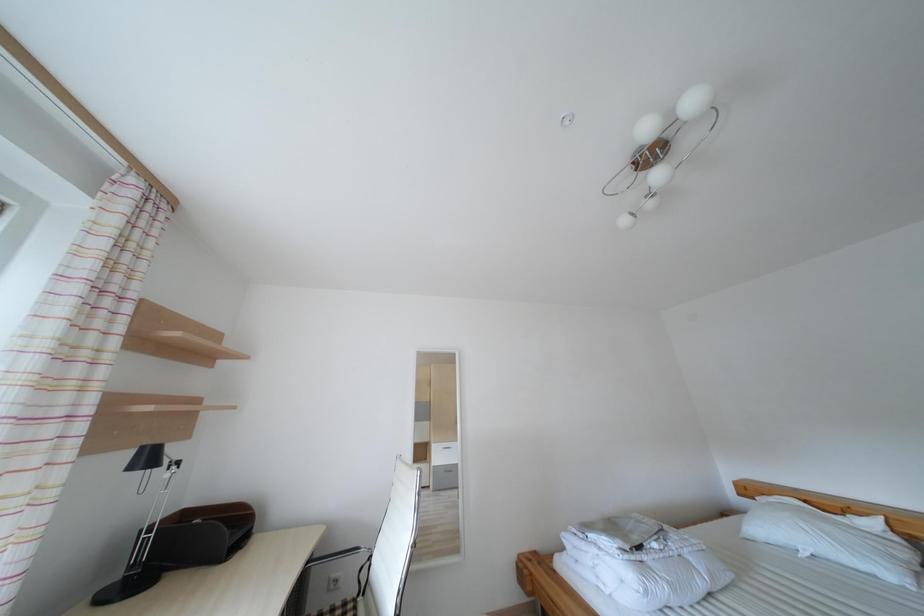
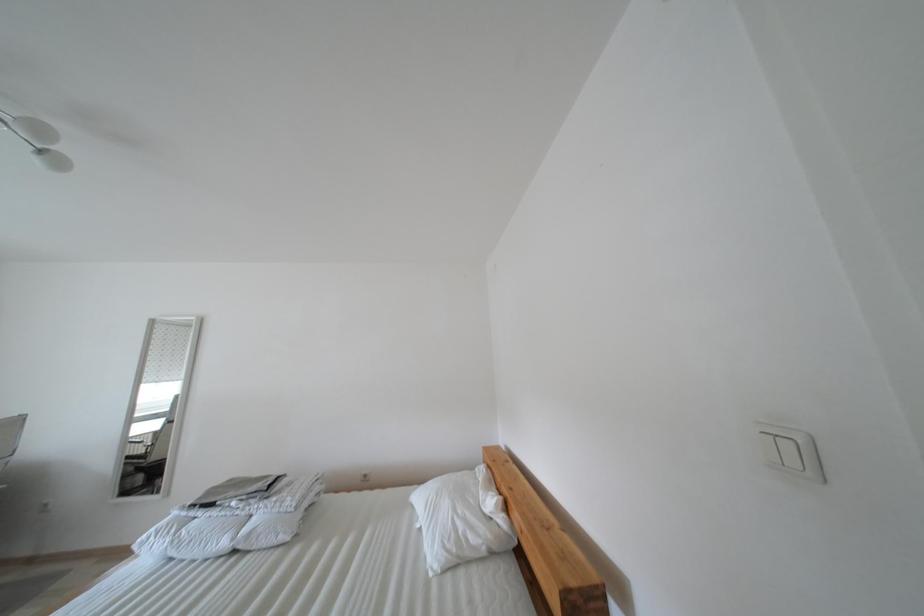
Question: In a continuous first-person perspective shot, in which direction is the camera moving?

Choices:
 (A) Left
 (B) Right
 (C) Forward
 (D) Backward

Answer: (B)